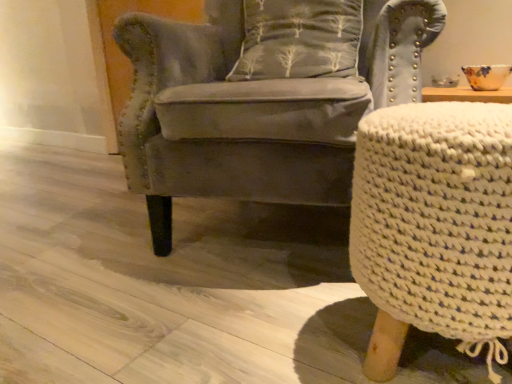
Question: Is gray fabric pillow with tree pattern at center oriented away from velvet gray armchair at center?

Choices:
 (A) no
 (B) yes

Answer: (B)

Question: From the image's perspective, does gray fabric pillow with tree pattern at center appear lower than velvet gray armchair at center?

Choices:
 (A) yes
 (B) no

Answer: (B)

Question: Is gray fabric pillow with tree pattern at center smaller than velvet gray armchair at center?

Choices:
 (A) no
 (B) yes

Answer: (B)

Question: Does gray fabric pillow with tree pattern at center turn towards velvet gray armchair at center?

Choices:
 (A) yes
 (B) no

Answer: (A)

Question: Is gray fabric pillow with tree pattern at center placed right next to velvet gray armchair at center?

Choices:
 (A) no
 (B) yes

Answer: (A)

Question: Does gray fabric pillow with tree pattern at center lie in front of velvet gray armchair at center?

Choices:
 (A) yes
 (B) no

Answer: (B)

Question: Is white knitted stool at right not within velvet gray armchair at center?

Choices:
 (A) no
 (B) yes

Answer: (B)

Question: From the image's perspective, is white knitted stool at right above velvet gray armchair at center?

Choices:
 (A) no
 (B) yes

Answer: (A)

Question: Does white knitted stool at right have a greater width compared to velvet gray armchair at center?

Choices:
 (A) no
 (B) yes

Answer: (A)

Question: Is white knitted stool at right positioned before velvet gray armchair at center?

Choices:
 (A) no
 (B) yes

Answer: (B)

Question: Would you consider white knitted stool at right to be distant from velvet gray armchair at center?

Choices:
 (A) no
 (B) yes

Answer: (A)

Question: From a real-world perspective, is white knitted stool at right located higher than velvet gray armchair at center?

Choices:
 (A) yes
 (B) no

Answer: (B)

Question: Is velvet gray armchair at center looking in the opposite direction of gray fabric pillow with tree pattern at center?

Choices:
 (A) yes
 (B) no

Answer: (A)